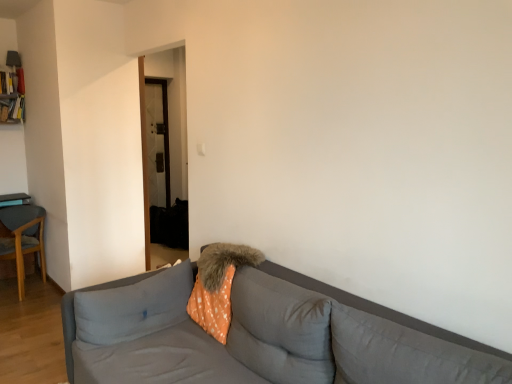
Question: Does fuzzy orange pillow at center, positioned as the second pillow in left-to-right order, have a larger size compared to orange polka dot pillow at center, the first pillow when ordered from left to right?

Choices:
 (A) yes
 (B) no

Answer: (B)

Question: Would you say fuzzy orange pillow at center, positioned as the second pillow in left-to-right order, contains orange polka dot pillow at center, the first pillow when ordered from left to right?

Choices:
 (A) yes
 (B) no

Answer: (B)

Question: From the image's perspective, would you say fuzzy orange pillow at center, positioned as the second pillow in left-to-right order, is positioned over orange polka dot pillow at center, the fourth pillow in the right-to-left sequence?

Choices:
 (A) no
 (B) yes

Answer: (B)

Question: Can you confirm if fuzzy orange pillow at center, positioned as the second pillow in left-to-right order, is shorter than orange polka dot pillow at center, the first pillow when ordered from left to right?

Choices:
 (A) no
 (B) yes

Answer: (B)

Question: From a real-world perspective, is fuzzy orange pillow at center, placed as the 3th pillow when sorted from right to left, physically above orange polka dot pillow at center, the fourth pillow in the right-to-left sequence?

Choices:
 (A) yes
 (B) no

Answer: (A)

Question: Is fuzzy orange pillow at center, positioned as the second pillow in left-to-right order, wider than orange polka dot pillow at center, the fourth pillow in the right-to-left sequence?

Choices:
 (A) no
 (B) yes

Answer: (B)

Question: Can you confirm if orange polka dot pillow at center, which is the 3th pillow from left to right, is smaller than gray fabric couch at center?

Choices:
 (A) no
 (B) yes

Answer: (B)

Question: Is the depth of orange polka dot pillow at center, which is the 3th pillow from left to right, greater than that of gray fabric couch at center?

Choices:
 (A) yes
 (B) no

Answer: (A)

Question: Is orange polka dot pillow at center, which is the 3th pillow from left to right, completely or partially outside of gray fabric couch at center?

Choices:
 (A) no
 (B) yes

Answer: (A)

Question: Does orange polka dot pillow at center, which ranks as the 2th pillow in right-to-left order, have a greater width compared to gray fabric couch at center?

Choices:
 (A) no
 (B) yes

Answer: (A)

Question: From the image's perspective, is orange polka dot pillow at center, which is the 3th pillow from left to right, on gray fabric couch at center?

Choices:
 (A) no
 (B) yes

Answer: (B)

Question: Is orange polka dot pillow at center, which is the 3th pillow from left to right, positioned far away from gray fabric couch at center?

Choices:
 (A) no
 (B) yes

Answer: (A)

Question: Is gray fabric couch at center shorter than orange polka dot fabric at center?

Choices:
 (A) yes
 (B) no

Answer: (B)